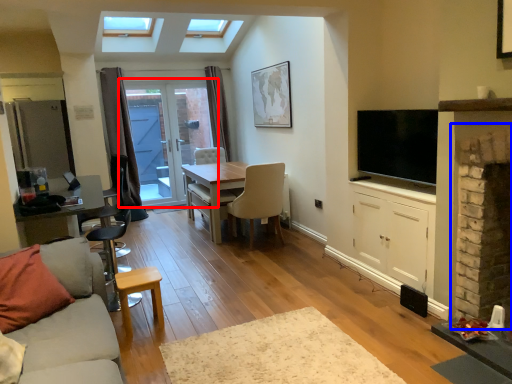
Question: Which point is closer to the camera, door (highlighted by a red box) or fireplace (highlighted by a blue box)?

Choices:
 (A) door
 (B) fireplace

Answer: (B)